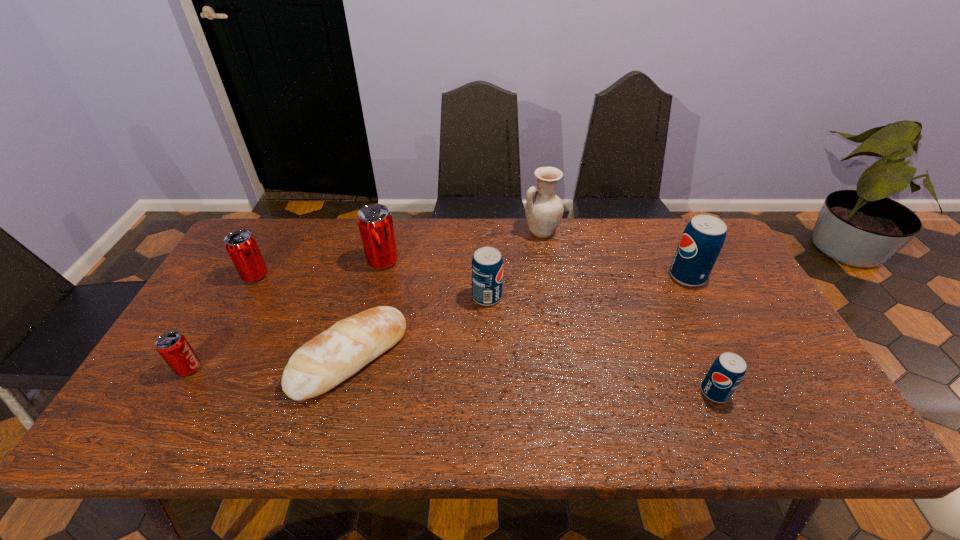
Select which object appears as the fifth closest to the second biggest red soda can. Please provide its 2D coordinates. Your answer should be formatted as a tuple, i.e. [(x, y)], where the tuple contains the x and y coordinates of a point satisfying the conditions above.

[(544, 210)]

The image size is (960, 540). In order to click on object that can be found as the second closest to the second biggest red soda can in this screenshot , I will do [173, 347].

Locate which pop ranks second in proximity to the second biggest red soda can. Please provide its 2D coordinates. Your answer should be formatted as a tuple, i.e. [(x, y)], where the tuple contains the x and y coordinates of a point satisfying the conditions above.

[(375, 223)]

Identify which pop is the nearest to the nearest red soda can. Please provide its 2D coordinates. Your answer should be formatted as a tuple, i.e. [(x, y)], where the tuple contains the x and y coordinates of a point satisfying the conditions above.

[(241, 245)]

This screenshot has height=540, width=960. Identify the location of red soda can that stands as the closest to the biggest blue pop. (375, 223).

This screenshot has height=540, width=960. Identify the location of the second closest red soda can to the second biggest red soda can. (375, 223).

Identify the location of the closest blue pop to the nearest red soda can. (487, 263).

Locate an element on the screen. Image resolution: width=960 pixels, height=540 pixels. the third closest blue pop relative to the second biggest red soda can is located at coordinates (703, 238).

Image resolution: width=960 pixels, height=540 pixels. What are the coordinates of `vacant space that satisfies the following two spatial constraints: 1. on the back side of the smallest red soda can; 2. on the left side of the rightmost red soda can` in the screenshot? It's located at click(251, 261).